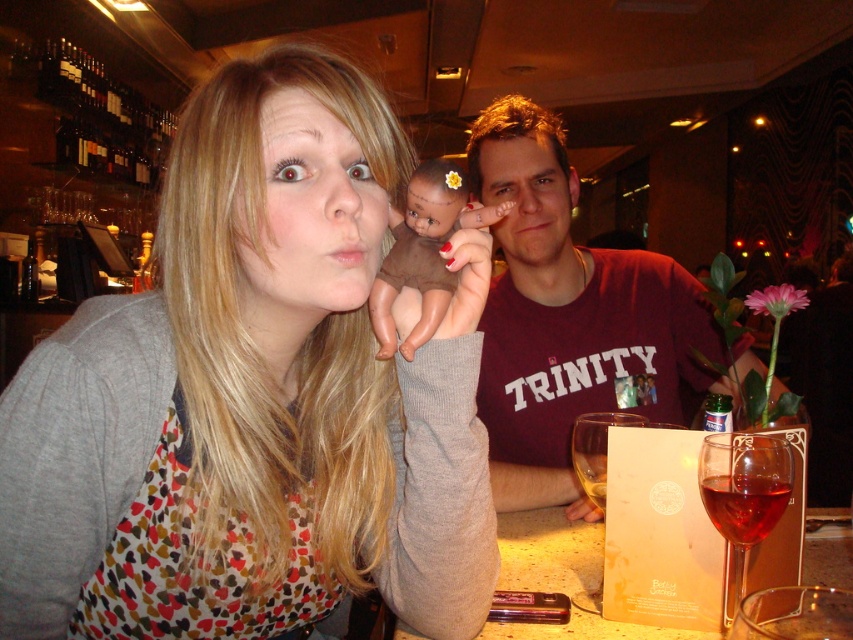
Question: Among these objects, which one is nearest to the camera?

Choices:
 (A) dark glass bottles at upper left
 (B) red glass at center

Answer: (B)

Question: Which object is closer to the camera taking this photo?

Choices:
 (A) brown matte baby doll at center
 (B) red glass at center
 (C) dark glass bottles at upper left

Answer: (A)

Question: Does maroon cotton shirt at center have a smaller size compared to dark glass bottles at upper left?

Choices:
 (A) no
 (B) yes

Answer: (B)

Question: Which object is the farthest from the matte gray sweater at center?

Choices:
 (A) translucent glass wine at center right
 (B) maroon cotton shirt at center
 (C) red glass at center

Answer: (B)

Question: Is maroon cotton shirt at center positioned in front of translucent glass wine at center right?

Choices:
 (A) no
 (B) yes

Answer: (A)

Question: Can you confirm if translucent glass wine at center right is positioned to the left of red glass wine at lower right?

Choices:
 (A) no
 (B) yes

Answer: (A)